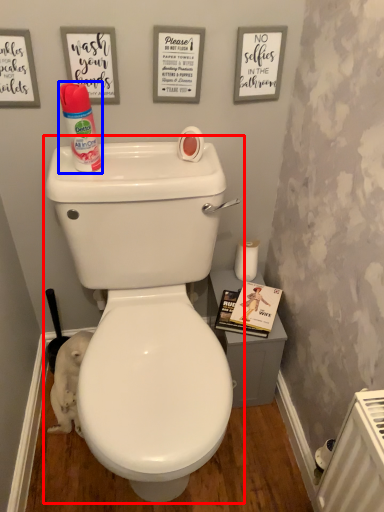
Question: Which object appears farthest to the camera in this image, toilet (highlighted by a red box) or cleaning product (highlighted by a blue box)?

Choices:
 (A) toilet
 (B) cleaning product

Answer: (B)